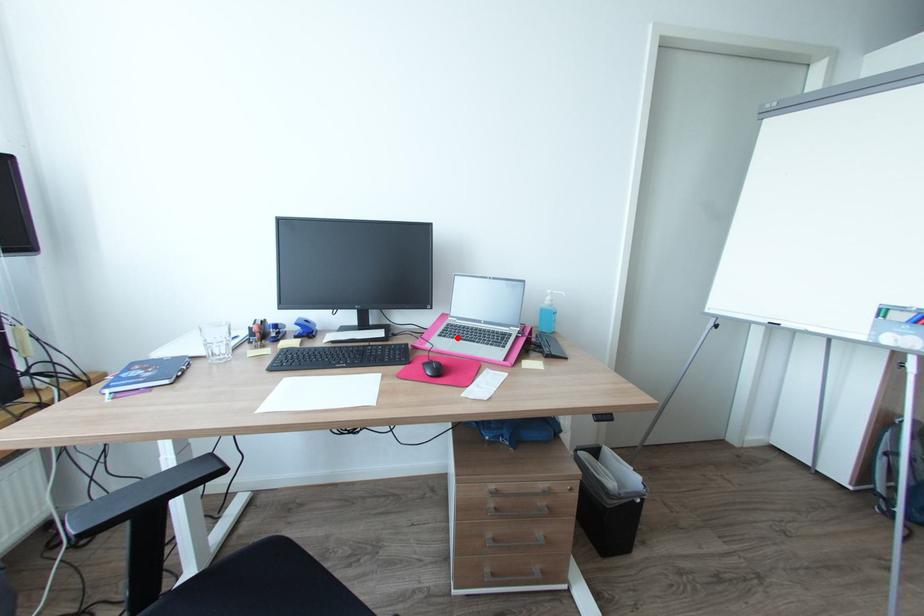
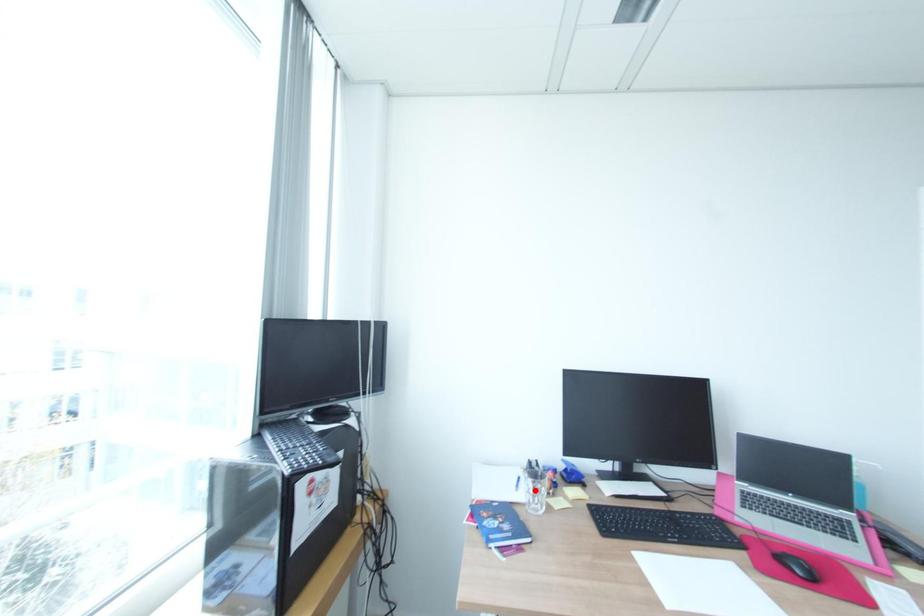
I am providing you with two images of the same scene from different viewpoints. A red point is marked on the first image and another point is marked on the second image. Is the red point in image1 aligned with the point shown in image2?

No